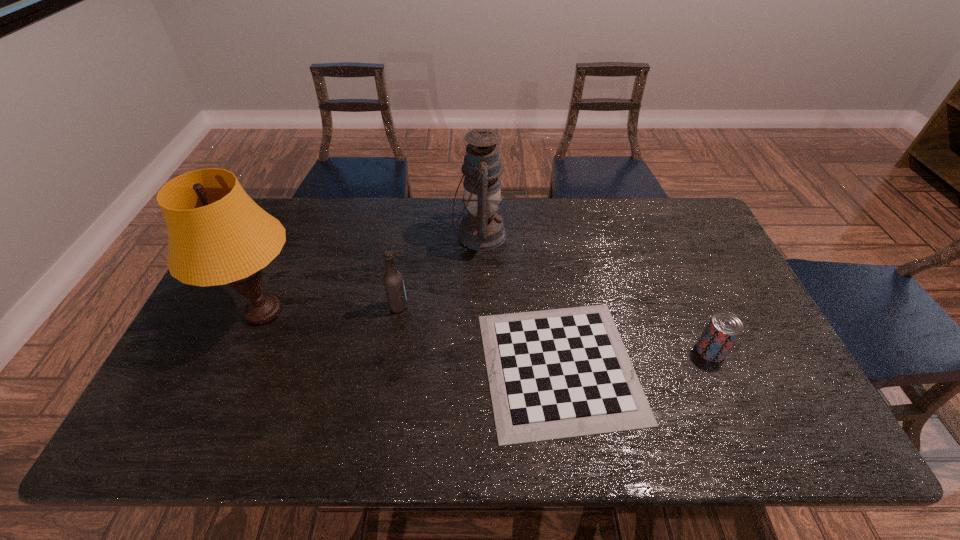
At what (x,y) coordinates should I click in order to perform the action: click on free space located 0.130m on the front of the beer can. Please return your answer as a coordinate pair (x, y). Image resolution: width=960 pixels, height=540 pixels. Looking at the image, I should click on (736, 410).

Find the location of a particular element. Image resolution: width=960 pixels, height=540 pixels. vacant area situated 0.300m on the right of the chessboard is located at coordinates (758, 367).

At what (x,y) coordinates should I click in order to perform the action: click on object positioned at the far edge. Please return your answer as a coordinate pair (x, y). The width and height of the screenshot is (960, 540). Looking at the image, I should click on (481, 229).

Locate an element on the screen. The width and height of the screenshot is (960, 540). object positioned at the near edge is located at coordinates (560, 373).

What are the coordinates of `object located in the left edge section of the desktop` in the screenshot? It's located at (217, 235).

Find the location of a particular element. The height and width of the screenshot is (540, 960). object located at the right edge is located at coordinates (724, 328).

The height and width of the screenshot is (540, 960). In order to click on free space at the far edge of the desktop in this screenshot , I will do `click(426, 201)`.

Locate an element on the screen. This screenshot has width=960, height=540. vacant space at the near edge of the desktop is located at coordinates (671, 415).

The width and height of the screenshot is (960, 540). In order to click on free space at the right edge of the desktop in this screenshot , I will do `click(694, 299)`.

Where is `free space at the far left corner`? free space at the far left corner is located at coordinates (289, 207).